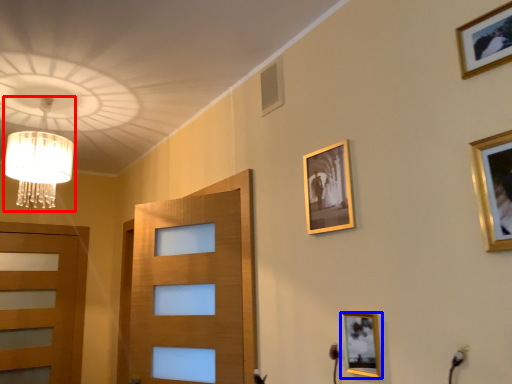
Question: Which object is closer to the camera taking this photo, lamp (highlighted by a red box) or picture frame (highlighted by a blue box)?

Choices:
 (A) lamp
 (B) picture frame

Answer: (B)